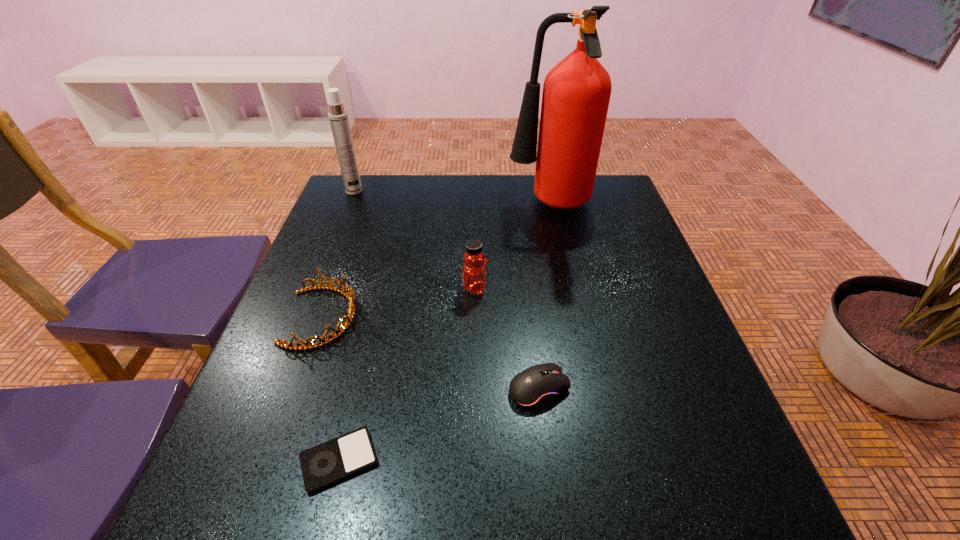
Find the location of `vacant space in between the fifth farthest object and the tiara`. vacant space in between the fifth farthest object and the tiara is located at coordinates (431, 353).

Choose which object is the third nearest neighbor to the fire extinguisher. Please provide its 2D coordinates. Your answer should be formatted as a tuple, i.e. [(x, y)], where the tuple contains the x and y coordinates of a point satisfying the conditions above.

[(338, 117)]

Identify which object is the third closest to the third shortest object. Please provide its 2D coordinates. Your answer should be formatted as a tuple, i.e. [(x, y)], where the tuple contains the x and y coordinates of a point satisfying the conditions above.

[(535, 387)]

Locate an element on the screen. This screenshot has height=540, width=960. free space that satisfies the following two spatial constraints: 1. on the front-facing side of the second shortest object; 2. on the right side of the tiara is located at coordinates (297, 388).

Locate an element on the screen. This screenshot has height=540, width=960. free region that satisfies the following two spatial constraints: 1. on the back side of the second shortest object; 2. on the left side of the shortest object is located at coordinates (357, 388).

You are a GUI agent. You are given a task and a screenshot of the screen. Output one action in this format:
    pyautogui.click(x=<x>, y=<y>)
    Task: Click on the free space that satisfies the following two spatial constraints: 1. on the back side of the second shortest object; 2. on the front label of the honey
    The image size is (960, 540).
    Given the screenshot: What is the action you would take?
    527,288

Identify the location of vacant area in the image that satisfies the following two spatial constraints: 1. on the front label of the fourth shortest object; 2. on the front side of the iPod. This screenshot has height=540, width=960. pyautogui.click(x=473, y=460).